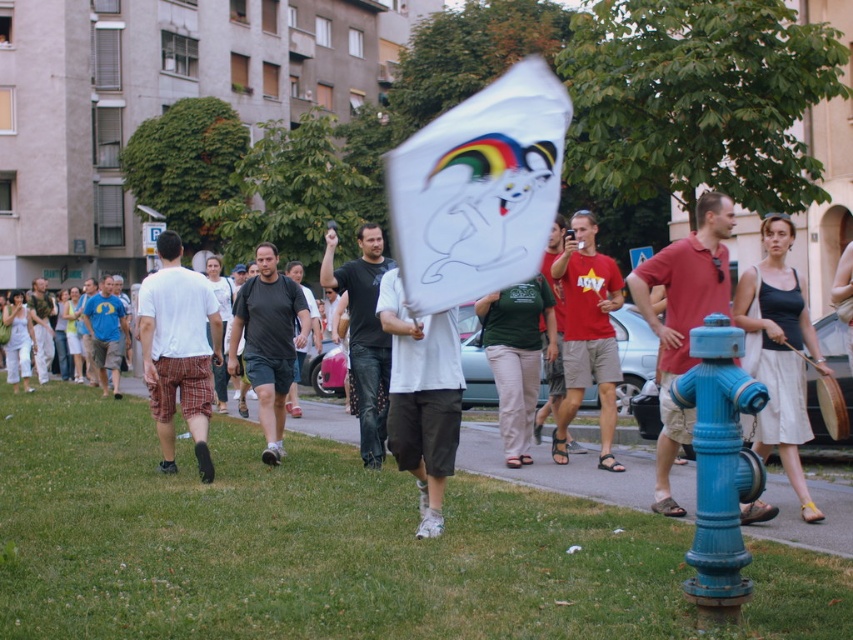
Is red cotton t-shirt at center shorter than black cotton t-shirt at center?

Yes.

This screenshot has width=853, height=640. What do you see at coordinates (587, 333) in the screenshot?
I see `red cotton t-shirt at center` at bounding box center [587, 333].

Measure the distance between red cotton t-shirt at center and camera.

They are 10.26 meters apart.

The width and height of the screenshot is (853, 640). Identify the location of red cotton t-shirt at center. (587, 333).

Who is more distant from viewer, (697, 355) or (712, 264)?

The point (712, 264) is behind.

Does blue painted metal fire hydrant at lower right appear on the left side of matte red shirt at center?

A: Correct, you'll find blue painted metal fire hydrant at lower right to the left of matte red shirt at center.

The width and height of the screenshot is (853, 640). I want to click on blue painted metal fire hydrant at lower right, so click(718, 465).

Which is more to the right, gravel at lower center or white matte kite at center?

white matte kite at center

The image size is (853, 640). What do you see at coordinates (560, 470) in the screenshot? I see `gravel at lower center` at bounding box center [560, 470].

I want to click on gravel at lower center, so click(560, 470).